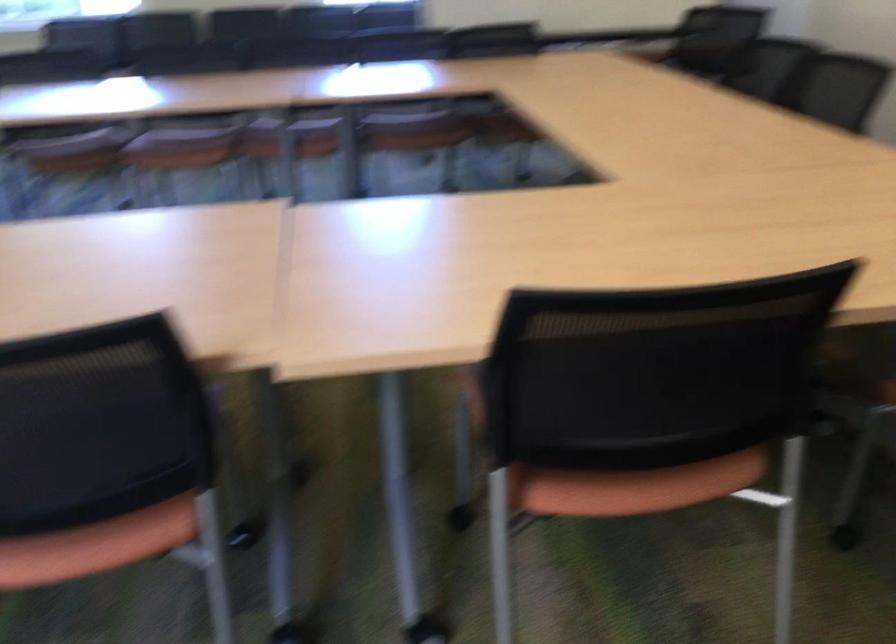
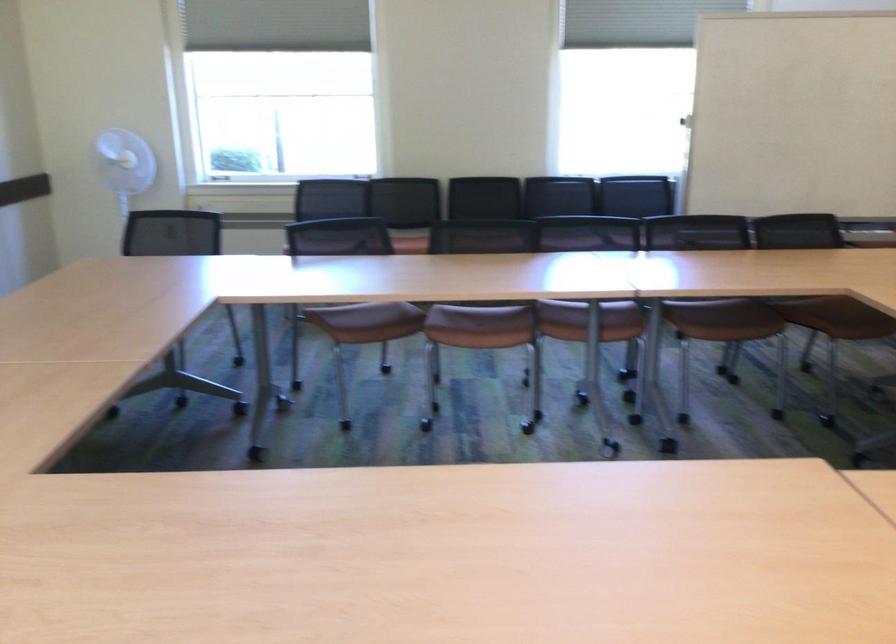
Locate, in the second image, the point that corresponds to point 175,131 in the first image.

(483, 310)